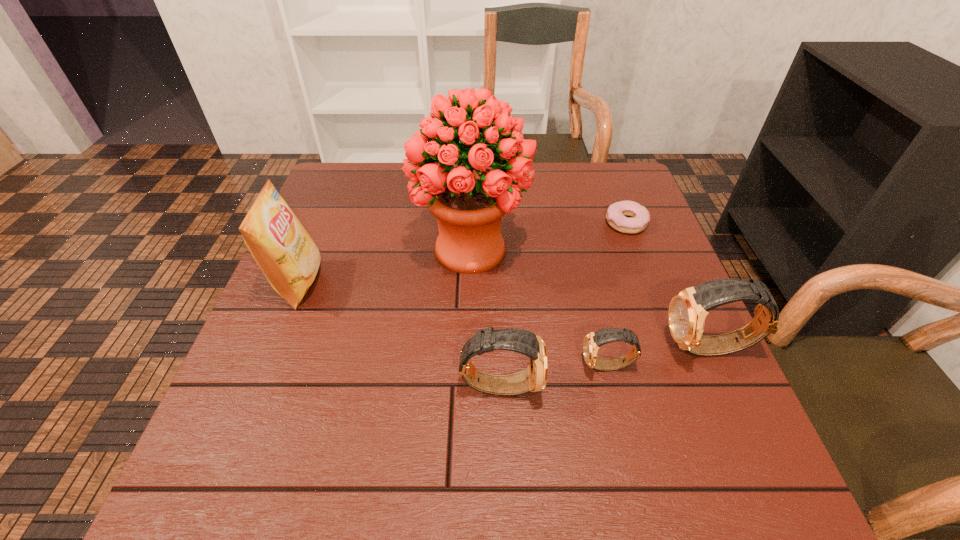
Where is `vacant area that lies between the fifth tallest object and the rightmost watch`? vacant area that lies between the fifth tallest object and the rightmost watch is located at coordinates (659, 357).

Where is `unoccupied position between the second tallest watch and the crisp (potato chip)`? This screenshot has height=540, width=960. unoccupied position between the second tallest watch and the crisp (potato chip) is located at coordinates (399, 334).

I want to click on free space between the second watch from right to left and the leftmost watch, so click(x=554, y=375).

You are a GUI agent. You are given a task and a screenshot of the screen. Output one action in this format:
    pyautogui.click(x=<x>, y=<y>)
    Task: Click on the free spot between the rightmost watch and the shortest watch
    The width and height of the screenshot is (960, 540).
    Given the screenshot: What is the action you would take?
    pyautogui.click(x=659, y=357)

At what (x,y) coordinates should I click in order to perform the action: click on free space that is in between the tallest object and the second tallest object. Please return your answer as a coordinate pair (x, y). The width and height of the screenshot is (960, 540). Looking at the image, I should click on (385, 266).

Identify the location of blank region between the second watch from left to right and the doughnut. (617, 294).

Locate an element on the screen. This screenshot has width=960, height=540. blank region between the doughnut and the rightmost watch is located at coordinates (668, 286).

The image size is (960, 540). I want to click on free space between the leftmost watch and the shortest watch, so click(x=554, y=375).

I want to click on object that is the closest to the bouquet, so click(x=593, y=340).

At what (x,y) coordinates should I click in order to perform the action: click on object that is the fourth closest to the fifth tallest object. Please return your answer as a coordinate pair (x, y). Looking at the image, I should click on (616, 213).